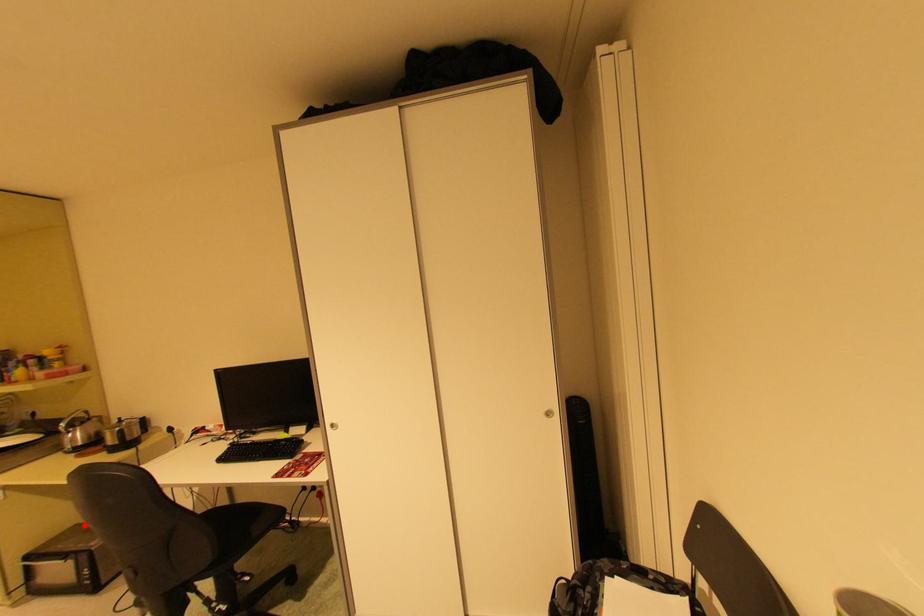
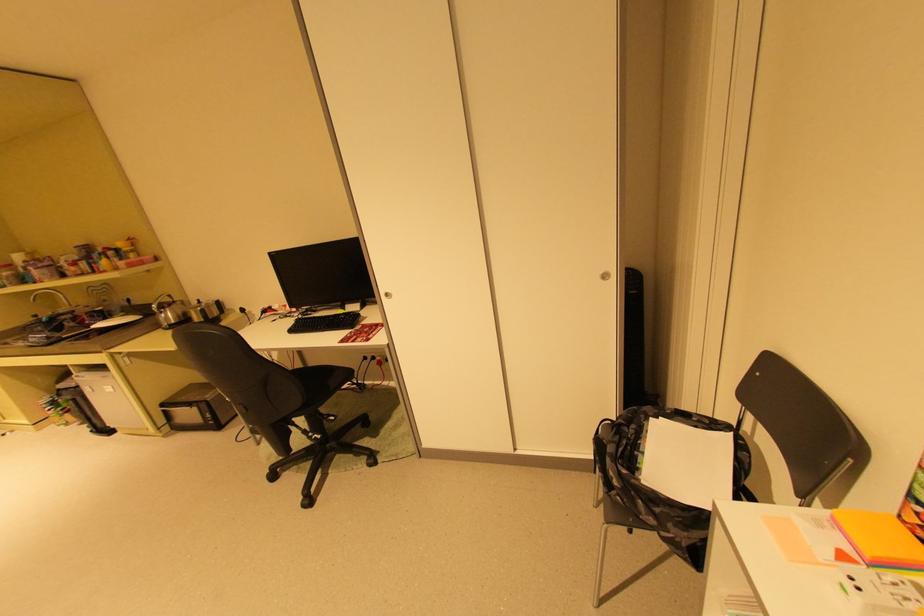
The point at the highlighted location is marked in the first image. Where is the corresponding point in the second image?

(199, 385)